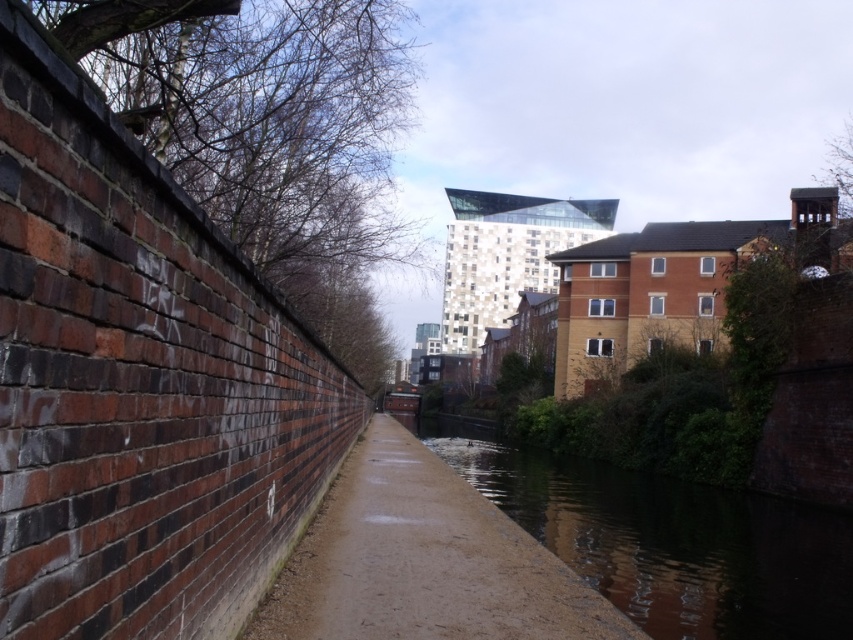
Can you confirm if dark reflective water at center is positioned above sandy concrete path at center?

Incorrect, dark reflective water at center is not positioned above sandy concrete path at center.

Does dark reflective water at center have a greater height compared to sandy concrete path at center?

Indeed, dark reflective water at center has a greater height compared to sandy concrete path at center.

Does point (734, 632) lie behind point (397, 564)?

Yes, it is.

This screenshot has width=853, height=640. Find the location of `dark reflective water at center`. dark reflective water at center is located at coordinates (668, 541).